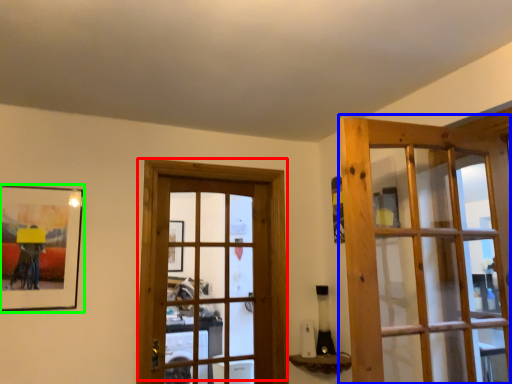
Question: Which is farther away from door (highlighted by a red box)? door (highlighted by a blue box) or picture frame (highlighted by a green box)?

Choices:
 (A) door
 (B) picture frame

Answer: (A)